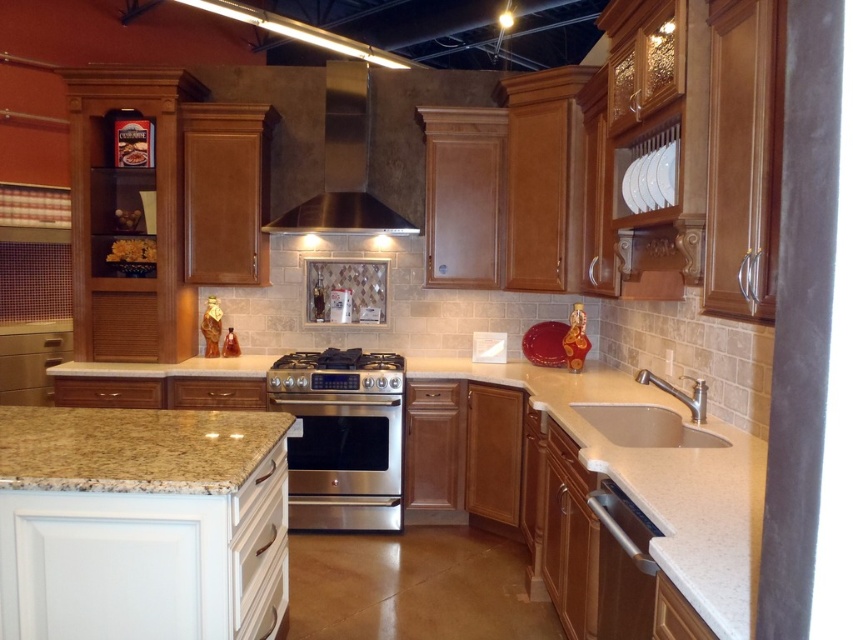
Question: Which point is farther from the camera taking this photo?

Choices:
 (A) (380, 228)
 (B) (631, 616)
 (C) (386, 385)
 (D) (753, 456)

Answer: (A)

Question: Does granite countertop at center appear over stainless steel stove at center?

Choices:
 (A) no
 (B) yes

Answer: (A)

Question: Which object is the farthest from the stainless steel exhaust hood at upper center?

Choices:
 (A) stainless steel oven at center
 (B) white porcelain sink at lower right

Answer: (B)

Question: Where is granite countertop at center located in relation to stainless steel stove at center in the image?

Choices:
 (A) left
 (B) right

Answer: (B)

Question: Does stainless steel exhaust hood at upper center have a greater width compared to satin stainless steel dishwasher at lower right?

Choices:
 (A) yes
 (B) no

Answer: (A)

Question: Which object is the closest to the granite countertop at center?

Choices:
 (A) stainless steel oven at center
 (B) stainless steel stove at center
 (C) white porcelain sink at lower right
 (D) satin stainless steel dishwasher at lower right

Answer: (C)